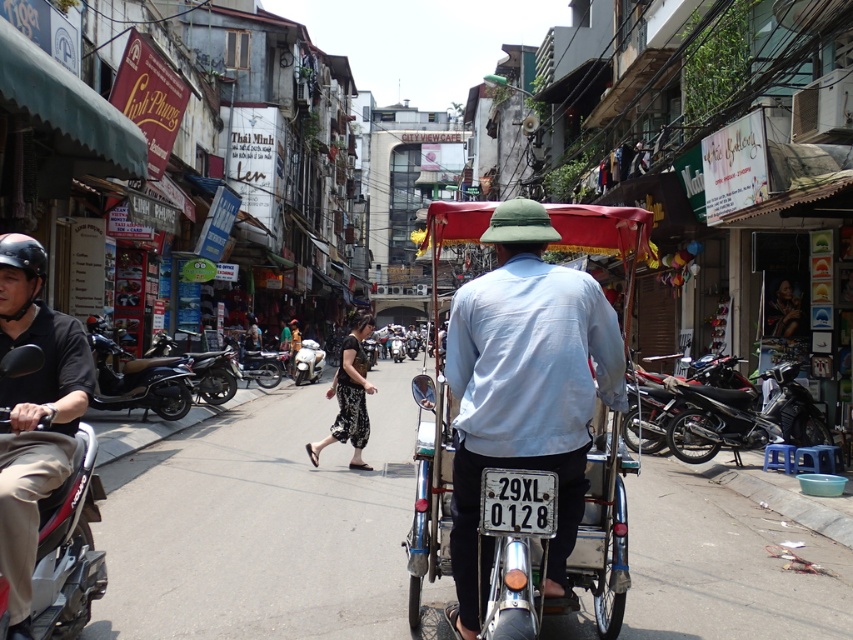
Is shiny black motorcycle at right taller than silver metallic scooter at center?

No, shiny black motorcycle at right is not taller than silver metallic scooter at center.

Where is `shiny black motorcycle at right`? This screenshot has height=640, width=853. shiny black motorcycle at right is located at coordinates (648, 410).

Find the location of a particular element. shiny black motorcycle at right is located at coordinates (648, 410).

Describe the element at coordinates (349, 396) in the screenshot. The height and width of the screenshot is (640, 853). I see `black textured pants at center` at that location.

Which is more to the left, black textured pants at center or silver metallic scooter at center?

silver metallic scooter at center

The width and height of the screenshot is (853, 640). Find the location of `black textured pants at center`. black textured pants at center is located at coordinates (349, 396).

This screenshot has height=640, width=853. I want to click on shiny black scooter at left, so click(x=138, y=378).